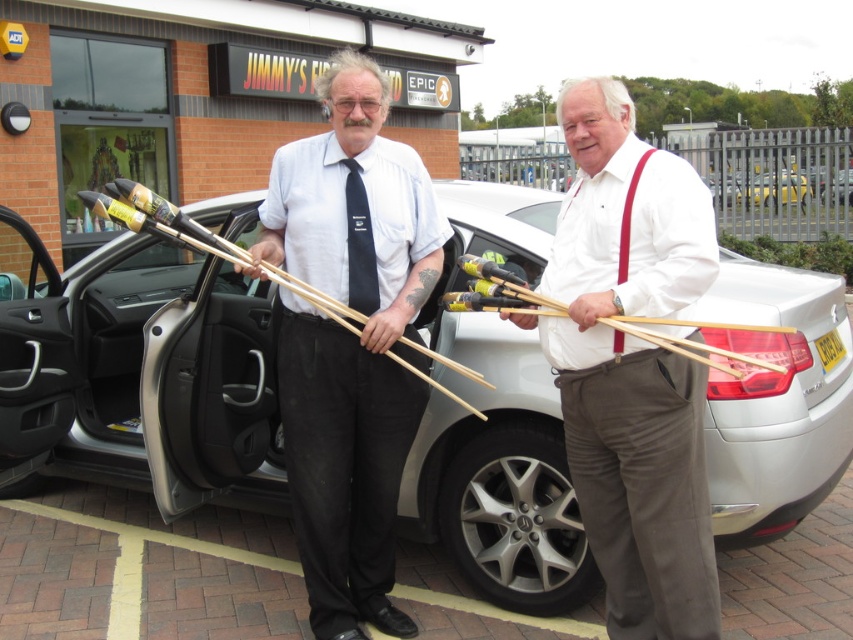
You are a parking attendant and need to guide a driver to park their new car between the two vehicles shown in the scene. The driver wants to park their car to the right of the white matte car at center and to the left of the white glossy sedan at center. Is this possible given the current arrangement?

The white matte car at center is already positioned to the left of the white glossy sedan at center. Therefore, there is no space between them for the driver to park their car in the requested position.

You are a parking attendant and need to park both the white matte car at center and the white glossy sedan at center in two adjacent spots. The spots are exactly the same size. Which car will require more space to park?

The white matte car at center requires more space to park because it has a larger size compared to the white glossy sedan at center.

You are a delivery person who needs to park your van in the parking area shown in the image. The van requires a parking spot that is at least 2.5 meters wide. The white matte car at center is currently occupying part of the parking space. Can you determine if there is enough space left in the parking area to park your van?

The white matte car at center is positioned at point (166, 371). However, without knowing the dimensions of the parking area or the exact size of the parking spot, it is impossible to determine if there is sufficient space for the van. Please consult the parking lot layout or measure the available space before proceeding.